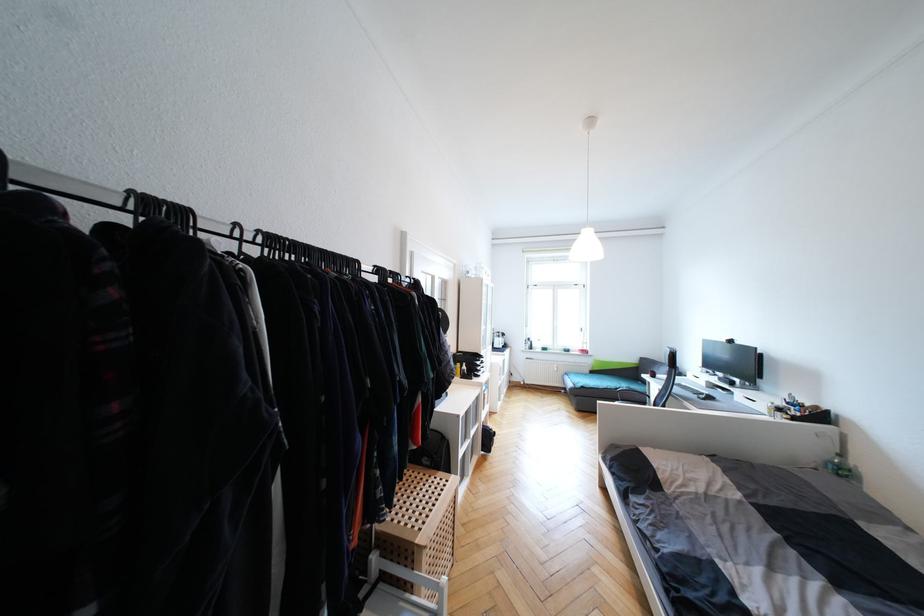
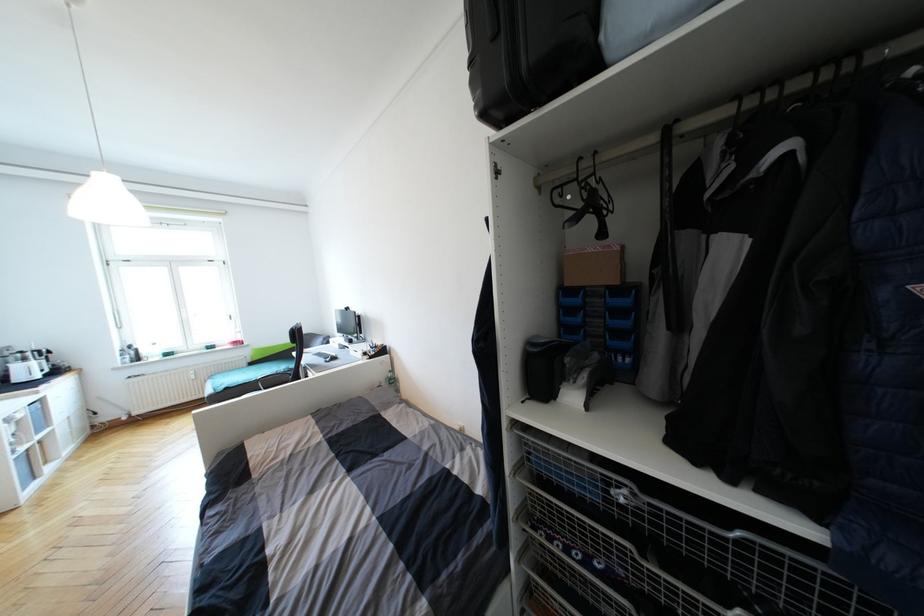
Locate, in the second image, the point that corresponds to point (845, 472) in the first image.

(395, 382)